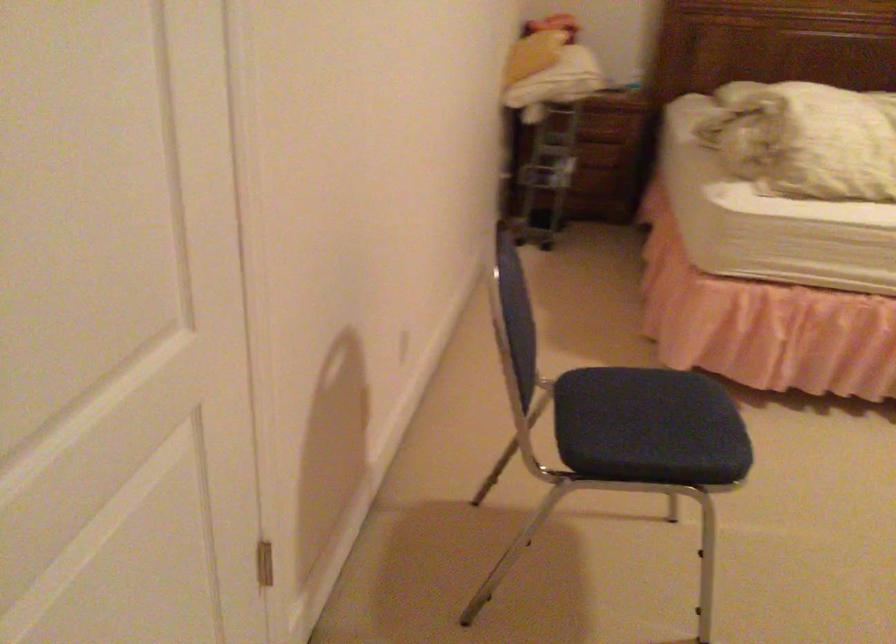
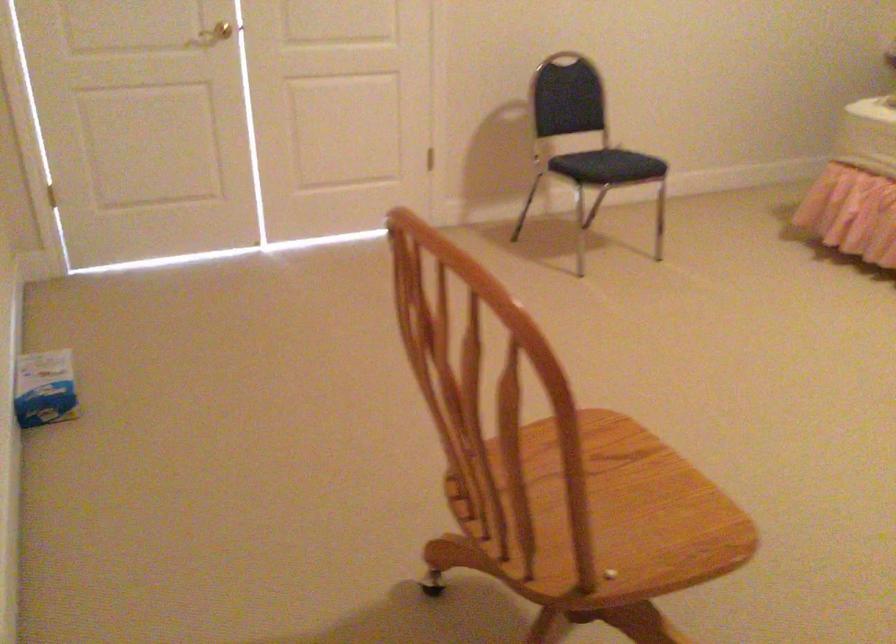
The point at (673, 442) is marked in the first image. Where is the corresponding point in the second image?

(607, 166)